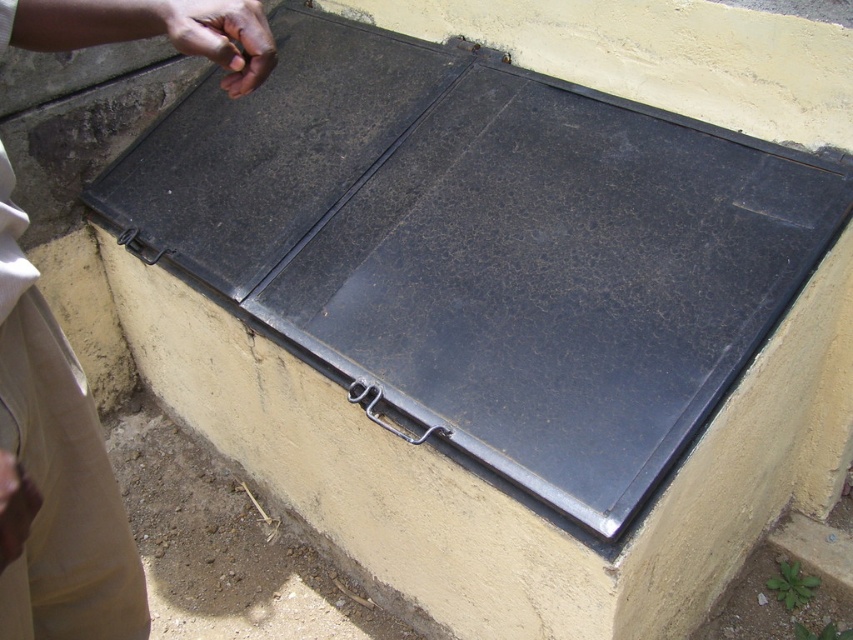
Question: Which point is closer to the camera?

Choices:
 (A) (268, 72)
 (B) (79, 621)

Answer: (A)

Question: Can you confirm if beige fabric pants at lower left is thinner than dark skin hand at upper left?

Choices:
 (A) no
 (B) yes

Answer: (A)

Question: Which object appears closest to the camera in this image?

Choices:
 (A) beige fabric pants at lower left
 (B) dark skin hand at upper left

Answer: (A)

Question: Does beige fabric pants at lower left appear under dark skin hand at upper left?

Choices:
 (A) no
 (B) yes

Answer: (B)

Question: Is beige fabric pants at lower left to the right of dark skin hand at upper left from the viewer's perspective?

Choices:
 (A) yes
 (B) no

Answer: (B)

Question: Which of the following is the farthest from the observer?

Choices:
 (A) dark skin hand at upper left
 (B) beige fabric pants at lower left

Answer: (A)